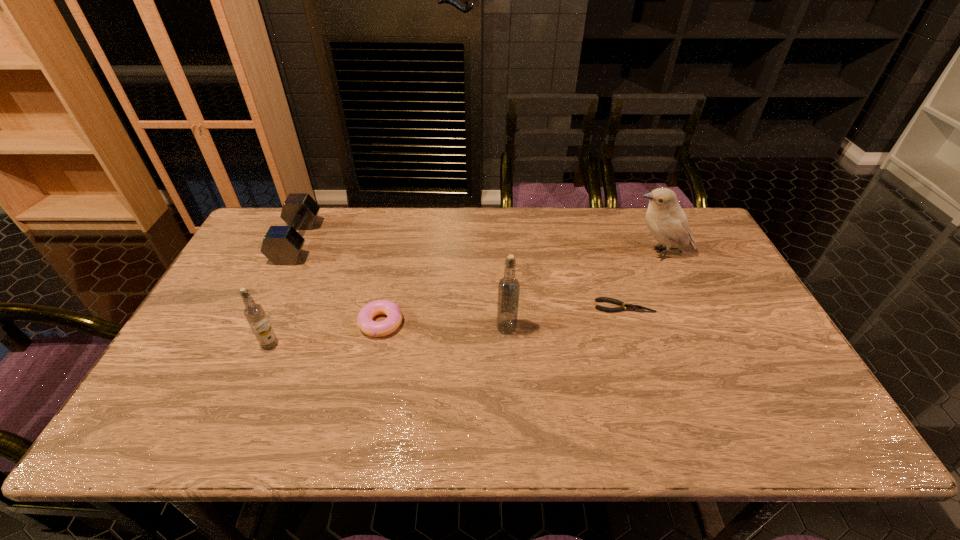
At what (x,y) coordinates should I click in order to perform the action: click on object that is at the right edge. Please return your answer as a coordinate pair (x, y). This screenshot has height=540, width=960. Looking at the image, I should click on (666, 220).

In order to click on object located in the far left corner section of the desktop in this screenshot , I will do `click(282, 245)`.

The height and width of the screenshot is (540, 960). I want to click on object at the far right corner, so click(x=666, y=220).

At what (x,y) coordinates should I click in order to perform the action: click on free space at the far edge of the desktop. Please return your answer as a coordinate pair (x, y). Looking at the image, I should click on (612, 225).

Locate an element on the screen. Image resolution: width=960 pixels, height=540 pixels. vacant space at the near edge of the desktop is located at coordinates point(644,401).

This screenshot has width=960, height=540. In the image, there is a desktop. What are the coordinates of `vacant region at the left edge` in the screenshot? It's located at (226, 332).

Identify the location of blank space at the right edge. (741, 299).

In the image, there is a desktop. Identify the location of free space at the near left corner. Image resolution: width=960 pixels, height=540 pixels. (161, 388).

I want to click on free space between the third shortest object and the shortest object, so click(461, 274).

This screenshot has height=540, width=960. Identify the location of vacant space in between the bird and the third shortest object. (478, 248).